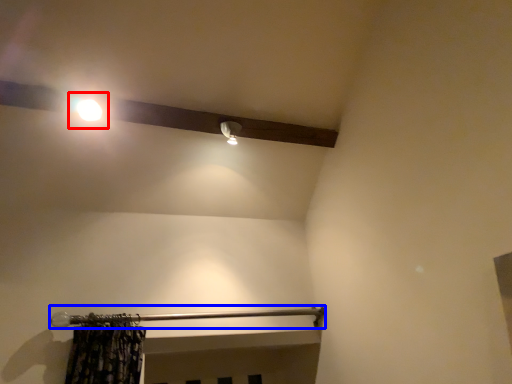
Question: Which object appears farthest to the camera in this image, moonlight (highlighted by a red box) or rail (highlighted by a blue box)?

Choices:
 (A) moonlight
 (B) rail

Answer: (A)